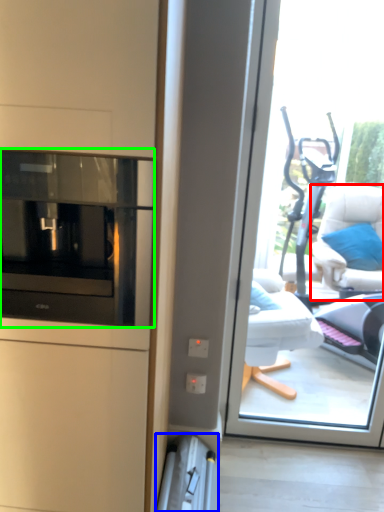
Question: Which is nearer to the furniture (highlighted by a red box)? appliance (highlighted by a blue box) or home appliance (highlighted by a green box).

Choices:
 (A) appliance
 (B) home appliance

Answer: (A)